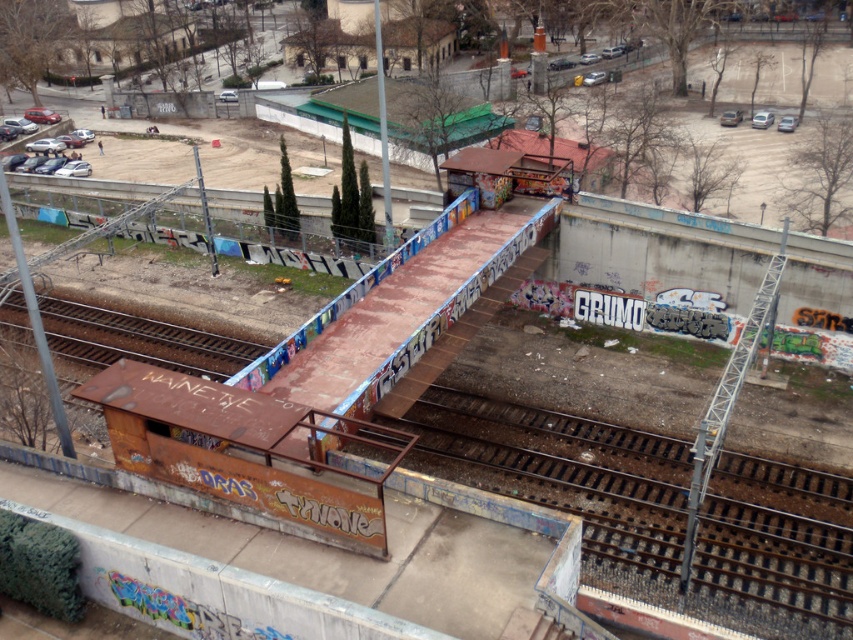
Can you confirm if rusty metal train track at lower center is thinner than rusty metal train track at lower left?

No.

Who is shorter, rusty metal train track at lower center or rusty metal train track at lower left?

Standing shorter between the two is rusty metal train track at lower left.

Which is in front, point (595, 497) or point (129, 336)?

Point (595, 497) is in front.

I want to click on rusty metal train track at lower center, so click(x=567, y=480).